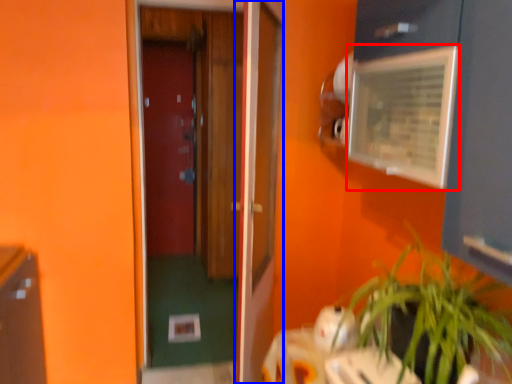
Question: Which point is further to the camera, medicine cabinet (highlighted by a red box) or door (highlighted by a blue box)?

Choices:
 (A) medicine cabinet
 (B) door

Answer: (B)